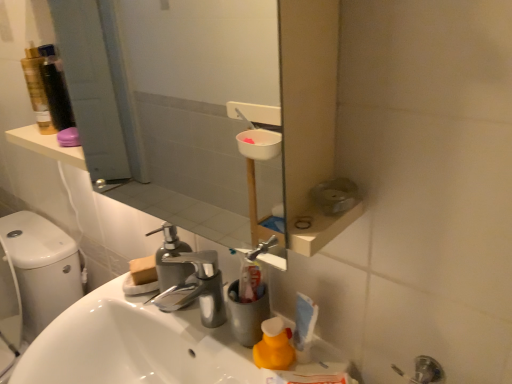
Question: Can you confirm if yellow matte cleaning product at lower center is smaller than white glossy sink at center?

Choices:
 (A) no
 (B) yes

Answer: (B)

Question: Is yellow matte cleaning product at lower center at the left side of white glossy sink at center?

Choices:
 (A) no
 (B) yes

Answer: (A)

Question: Is white glossy sink at center a part of yellow matte cleaning product at lower center?

Choices:
 (A) no
 (B) yes

Answer: (A)

Question: From a real-world perspective, is yellow matte cleaning product at lower center physically below white glossy sink at center?

Choices:
 (A) yes
 (B) no

Answer: (B)

Question: Is yellow matte cleaning product at lower center positioned in front of white glossy sink at center?

Choices:
 (A) no
 (B) yes

Answer: (A)

Question: Considering the relative sizes of yellow matte cleaning product at lower center and white glossy sink at center in the image provided, is yellow matte cleaning product at lower center thinner than white glossy sink at center?

Choices:
 (A) no
 (B) yes

Answer: (B)

Question: Can you confirm if white glossy sink at center is bigger than chrome metallic faucet at center?

Choices:
 (A) yes
 (B) no

Answer: (A)

Question: Does white glossy sink at center come behind chrome metallic faucet at center?

Choices:
 (A) no
 (B) yes

Answer: (A)

Question: Is white glossy sink at center beside chrome metallic faucet at center?

Choices:
 (A) yes
 (B) no

Answer: (B)

Question: Is white glossy sink at center aimed at chrome metallic faucet at center?

Choices:
 (A) yes
 (B) no

Answer: (B)

Question: From the image's perspective, is white glossy sink at center above chrome metallic faucet at center?

Choices:
 (A) yes
 (B) no

Answer: (B)

Question: Can chrome metallic faucet at center be found inside white glossy sink at center?

Choices:
 (A) no
 (B) yes

Answer: (A)

Question: From a real-world perspective, is white glossy sink at center under yellow matte cleaning product at lower center?

Choices:
 (A) yes
 (B) no

Answer: (A)